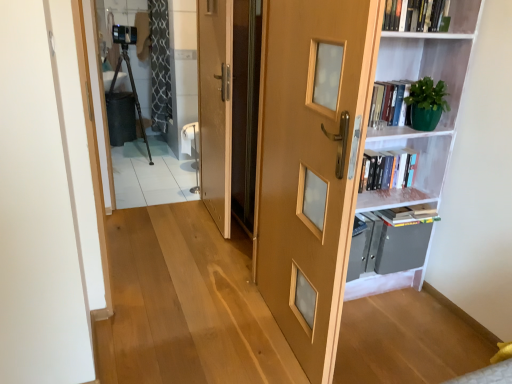
Where is `free space that is to the left of light brown wooden door at center, which is the 2th door in left-to-right order`? free space that is to the left of light brown wooden door at center, which is the 2th door in left-to-right order is located at coordinates (202, 334).